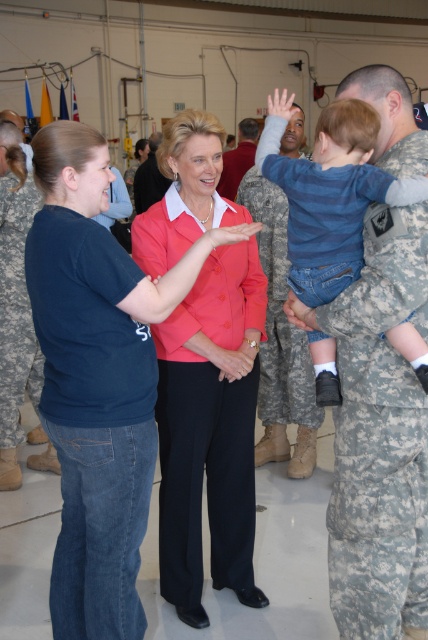
Question: Which point is farther to the camera?

Choices:
 (A) camouflage uniform at center
 (B) denim jeans at left
 (C) blue camouflage uniform at lower left

Answer: (A)

Question: Where is matte pink blazer at center located in relation to camouflage fabric uniform at right in the image?

Choices:
 (A) left
 (B) right

Answer: (A)

Question: Is matte pink blazer at center to the left of camouflage uniform at center from the viewer's perspective?

Choices:
 (A) no
 (B) yes

Answer: (B)

Question: Based on their relative distances, which object is nearer to the blue camouflage uniform at lower left?

Choices:
 (A) denim jeans at left
 (B) blue denim jeans at center

Answer: (A)

Question: Can you confirm if blue camouflage uniform at lower left is positioned below camouflage uniform at center?

Choices:
 (A) no
 (B) yes

Answer: (B)

Question: Among these objects, which one is nearest to the camera?

Choices:
 (A) blue camouflage uniform at lower left
 (B) matte pink blazer at center
 (C) camouflage fabric uniform at right

Answer: (C)